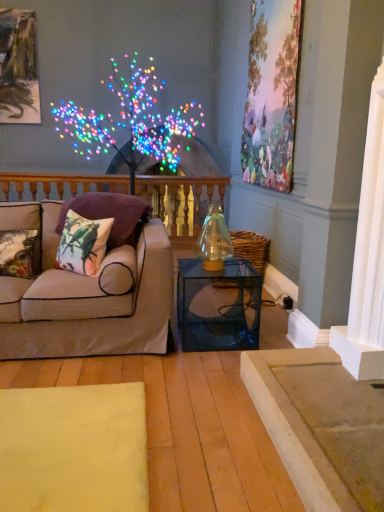
Where is `wooden balustrade at upper left`? wooden balustrade at upper left is located at coordinates (182, 203).

Describe the element at coordinates (18, 68) in the screenshot. I see `metallic gold picture frame at upper left, the 1th picture frame when ordered from left to right` at that location.

Image resolution: width=384 pixels, height=512 pixels. What do you see at coordinates (86, 296) in the screenshot? I see `beige fabric couch at left` at bounding box center [86, 296].

Identify the location of fluffy purple pillow at left, marked as the third pillow in a left-to-right arrangement. This screenshot has height=512, width=384. (111, 215).

Where is `pastel oil painting at upper right, the 2th picture frame from the left`? The height and width of the screenshot is (512, 384). pastel oil painting at upper right, the 2th picture frame from the left is located at coordinates (271, 93).

What is the approximate width of floral fabric cushion at left, marked as the 1th pillow in a left-to-right arrangement?

9.83 inches.

Locate an element on the screen. floral fabric cushion at left, marked as the 1th pillow in a left-to-right arrangement is located at coordinates (17, 253).

Where is `wooden balustrade at upper left`? The height and width of the screenshot is (512, 384). wooden balustrade at upper left is located at coordinates (182, 203).

Measure the distance between transparent glass table at center and pastel oil painting at upper right, arranged as the first picture frame when viewed from the right.

transparent glass table at center is 1.38 meters away from pastel oil painting at upper right, arranged as the first picture frame when viewed from the right.

From a real-world perspective, relative to pastel oil painting at upper right, the first picture frame when ordered from front to back, is transparent glass table at center vertically above or below?

transparent glass table at center is below pastel oil painting at upper right, the first picture frame when ordered from front to back.

Is point (253, 338) less distant than point (256, 26)?

Yes, point (253, 338) is in front of point (256, 26).

Considering the sizes of transparent glass table at center and pastel oil painting at upper right, arranged as the first picture frame when viewed from the right, in the image, is transparent glass table at center wider or thinner than pastel oil painting at upper right, arranged as the first picture frame when viewed from the right,?

In the image, transparent glass table at center appears to be wider than pastel oil painting at upper right, arranged as the first picture frame when viewed from the right.

From the image's perspective, between transparent glass table at center and floral fabric cushion at left, which is the third pillow from right to left, which one is located above?

floral fabric cushion at left, which is the third pillow from right to left.

Does transparent glass table at center appear on the left side of floral fabric cushion at left, which is the third pillow from right to left?

No.

Is transparent glass table at center behind floral fabric cushion at left, which is the third pillow from right to left?

That is False.

Is transparent glass table at center turned away from floral fabric cushion at left, marked as the 1th pillow in a left-to-right arrangement?

That's not correct — transparent glass table at center is not looking away from floral fabric cushion at left, marked as the 1th pillow in a left-to-right arrangement.

From the image's perspective, is transparent glass table at center above or below metallic gold picture frame at upper left, the 1th picture frame when ordered from left to right?

Clearly, from the image's perspective, transparent glass table at center is below metallic gold picture frame at upper left, the 1th picture frame when ordered from left to right.

How many degrees apart are the facing directions of transparent glass table at center and metallic gold picture frame at upper left, placed as the 1th picture frame when sorted from back to front?

The angle between the facing direction of transparent glass table at center and the facing direction of metallic gold picture frame at upper left, placed as the 1th picture frame when sorted from back to front, is 3.06 degrees.

Find the location of a particular element. table lying on the right of metallic gold picture frame at upper left, positioned as the 2th picture frame in front-to-back order is located at coordinates [x=218, y=306].

Is metallic gold picture frame at upper left, acting as the second picture frame starting from the right, a part of transparent glass table at center?

No, transparent glass table at center does not contain metallic gold picture frame at upper left, acting as the second picture frame starting from the right.

In the image, is metallic gold picture frame at upper left, the 1th picture frame when ordered from left to right, positioned in front of or behind transparent glass table at center?

metallic gold picture frame at upper left, the 1th picture frame when ordered from left to right, is behind transparent glass table at center.

From a real-world perspective, is metallic gold picture frame at upper left, the 1th picture frame when ordered from left to right, positioned under transparent glass table at center based on gravity?

No, from a real-world perspective, metallic gold picture frame at upper left, the 1th picture frame when ordered from left to right, is not under transparent glass table at center.

Is point (12, 95) farther from camera compared to point (192, 348)?

Yes, it is behind point (192, 348).

Which of these two, metallic gold picture frame at upper left, acting as the second picture frame starting from the right, or transparent glass table at center, is wider?

Wider between the two is transparent glass table at center.

From the image's perspective, which pillow is the 2nd one above the floral fabric cushion at left, which is the third pillow from right to left? Please provide its 2D coordinates.

[(111, 215)]

From a real-world perspective, is fluffy purple pillow at left, which is counted as the first pillow, starting from the right, below floral fabric cushion at left, marked as the 1th pillow in a left-to-right arrangement?

No, from a real-world perspective, fluffy purple pillow at left, which is counted as the first pillow, starting from the right, is not under floral fabric cushion at left, marked as the 1th pillow in a left-to-right arrangement.

In terms of width, does fluffy purple pillow at left, which is counted as the first pillow, starting from the right, look wider or thinner when compared to floral fabric cushion at left, which is the third pillow from right to left?

Considering their sizes, fluffy purple pillow at left, which is counted as the first pillow, starting from the right, looks broader than floral fabric cushion at left, which is the third pillow from right to left.

From a real-world perspective, relative to transparent glass table at center, is beige fabric couch at left vertically above or below?

beige fabric couch at left is situated higher than transparent glass table at center in the real world.

The image size is (384, 512). I want to click on table below the beige fabric couch at left (from the image's perspective), so click(x=218, y=306).

Is beige fabric couch at left at the right side of transparent glass table at center?

Incorrect, beige fabric couch at left is not on the right side of transparent glass table at center.

In terms of width, does beige fabric couch at left look wider or thinner when compared to transparent glass table at center?

beige fabric couch at left is wider than transparent glass table at center.

Which is behind, point (138, 309) or point (1, 199)?

The point (1, 199) is farther.

Consider the image. From a real-world perspective, between beige fabric couch at left and wooden balustrade at upper left, who is vertically lower?

beige fabric couch at left is physically lower.

Is beige fabric couch at left shorter than wooden balustrade at upper left?

Yes.

The height and width of the screenshot is (512, 384). What are the coordinates of `picture frame on the right of transparent glass table at center` in the screenshot? It's located at (271, 93).

Where is `the 1st pillow behind the transparent glass table at center, starting your count from the anchor`? Image resolution: width=384 pixels, height=512 pixels. the 1st pillow behind the transparent glass table at center, starting your count from the anchor is located at coordinates (17, 253).

When comparing their distances from metallic gold picture frame at upper left, placed as the 1th picture frame when sorted from back to front, does transparent glass table at center or pastel oil painting at upper right, the 2th picture frame from the left, seem further?

transparent glass table at center is positioned further to the anchor metallic gold picture frame at upper left, placed as the 1th picture frame when sorted from back to front.

Estimate the real-world distances between objects in this image. Which object is further from beige fabric couch at left, fluffy purple pillow at left, which is counted as the first pillow, starting from the right, or metallic gold picture frame at upper left, acting as the second picture frame starting from the right?

metallic gold picture frame at upper left, acting as the second picture frame starting from the right, is positioned further to the anchor beige fabric couch at left.

Which object lies nearer to the anchor point printed fabric pillow at left, positioned as the 2th pillow in left-to-right order, fluffy purple pillow at left, which is counted as the first pillow, starting from the right, or pastel oil painting at upper right, the 2th picture frame from the left?

The object closer to printed fabric pillow at left, positioned as the 2th pillow in left-to-right order, is fluffy purple pillow at left, which is counted as the first pillow, starting from the right.

Based on the photo, based on their spatial positions, is floral fabric cushion at left, which is the third pillow from right to left, or pastel oil painting at upper right, the 2th picture frame from the left, further from fluffy purple pillow at left, marked as the third pillow in a left-to-right arrangement?

pastel oil painting at upper right, the 2th picture frame from the left, lies further to fluffy purple pillow at left, marked as the third pillow in a left-to-right arrangement, than the other object.

Considering their positions, is floral fabric cushion at left, marked as the 1th pillow in a left-to-right arrangement, positioned further to beige fabric couch at left than wooden balustrade at upper left?

wooden balustrade at upper left is further to beige fabric couch at left.

Considering their positions, is fluffy purple pillow at left, which is counted as the first pillow, starting from the right, positioned closer to metallic gold picture frame at upper left, acting as the second picture frame starting from the right, than wooden balustrade at upper left?

wooden balustrade at upper left lies closer to metallic gold picture frame at upper left, acting as the second picture frame starting from the right, than the other object.

Looking at the image, which one is located further to transparent glass table at center, metallic gold picture frame at upper left, the 1th picture frame when ordered from left to right, or fluffy purple pillow at left, marked as the third pillow in a left-to-right arrangement?

metallic gold picture frame at upper left, the 1th picture frame when ordered from left to right.

Consider the image. From the image, which object appears to be farther from pastel oil painting at upper right, arranged as the first picture frame when viewed from the right, fluffy purple pillow at left, marked as the third pillow in a left-to-right arrangement, or wooden balustrade at upper left?

wooden balustrade at upper left lies further to pastel oil painting at upper right, arranged as the first picture frame when viewed from the right, than the other object.

Image resolution: width=384 pixels, height=512 pixels. I want to click on table positioned between printed fabric pillow at left, positioned as the 2th pillow in left-to-right order, and wooden balustrade at upper left from near to far, so click(218, 306).

Image resolution: width=384 pixels, height=512 pixels. I want to click on picture frame between beige fabric couch at left and wooden balustrade at upper left in the front-back direction, so click(271, 93).

The height and width of the screenshot is (512, 384). What are the coordinates of `pillow between beige fabric couch at left and floral fabric cushion at left, which is the third pillow from right to left, along the z-axis` in the screenshot? It's located at (83, 244).

The height and width of the screenshot is (512, 384). I want to click on studio couch between floral fabric cushion at left, which is the third pillow from right to left, and pastel oil painting at upper right, the first picture frame when ordered from front to back, in the horizontal direction, so click(x=86, y=296).